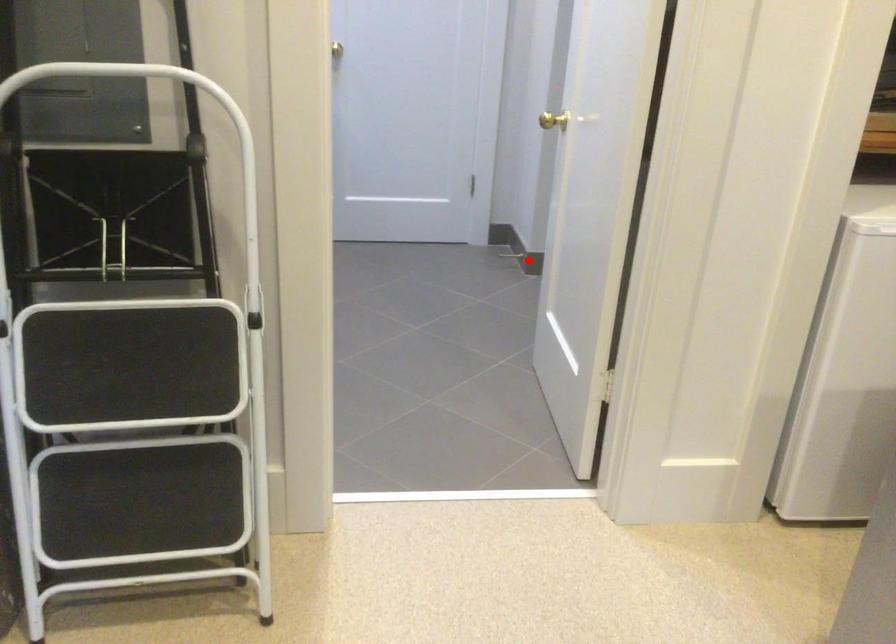
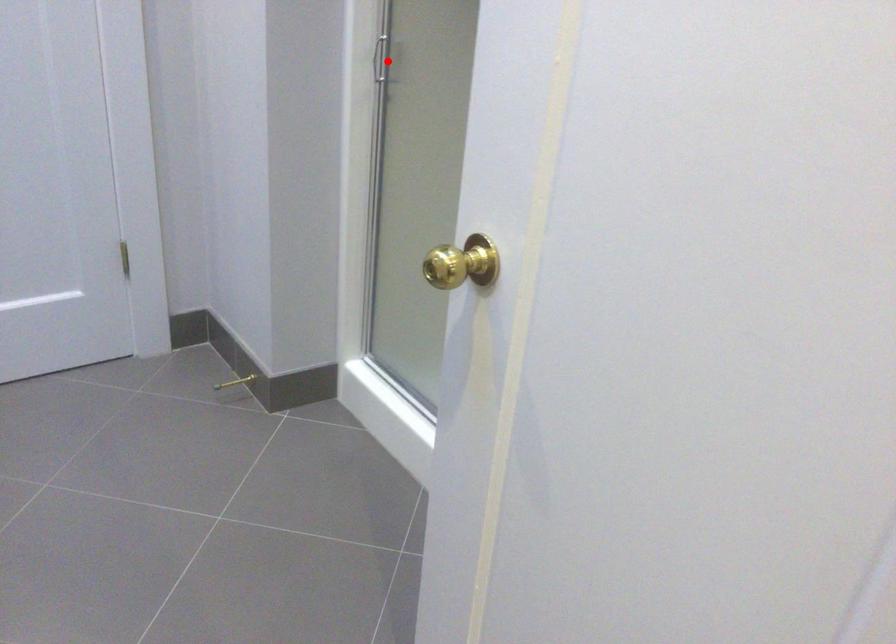
I am providing you with two images of the same scene from different viewpoints. A red point is marked on the first image and another point is marked on the second image. Does the point marked in image1 correspond to the same location as the one in image2?

No